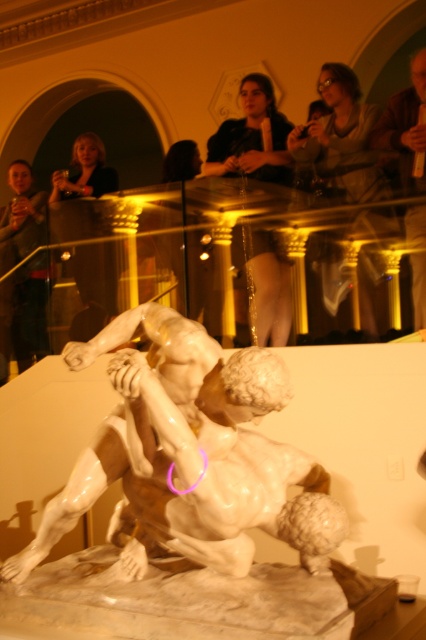
Measure the distance between point (226, 131) and camera.

Point (226, 131) and camera are 7.52 meters apart from each other.

Is white marble statue at center positioned at the back of matte brown jacket at upper right?

That is True.

I want to click on white marble statue at center, so click(x=252, y=138).

Between white glossy marble sculpture at center and matte brown jacket at upper right, which one appears on the right side from the viewer's perspective?

Positioned to the right is matte brown jacket at upper right.

What do you see at coordinates (189, 458) in the screenshot? The width and height of the screenshot is (426, 640). I see `white glossy marble sculpture at center` at bounding box center [189, 458].

Find the location of a particular element. white glossy marble sculpture at center is located at coordinates (189, 458).

Between point (287, 368) and point (26, 349), which one is positioned in front?

Point (287, 368) is more forward.

Image resolution: width=426 pixels, height=640 pixels. I want to click on white glossy marble sculpture at center, so click(x=189, y=458).